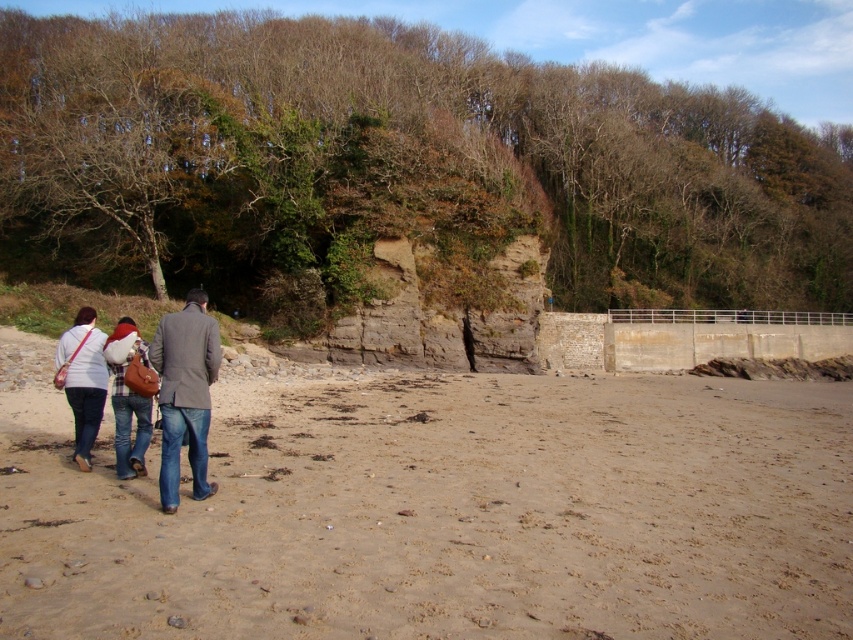
Question: Does brown leafy tree at upper center have a lesser width compared to denim jacket at lower left?

Choices:
 (A) no
 (B) yes

Answer: (A)

Question: Does sandy at left appear over matte white shirt at lower left?

Choices:
 (A) no
 (B) yes

Answer: (A)

Question: Which of these objects is positioned farthest from the matte white shirt at lower left?

Choices:
 (A) denim jacket at left
 (B) brown leafy tree at upper center
 (C) denim jacket at lower left

Answer: (B)

Question: Which point is farther from the camera taking this photo?

Choices:
 (A) (213, 317)
 (B) (270, 401)
 (C) (74, 424)

Answer: (B)

Question: Which point is closer to the camera?

Choices:
 (A) pos(164,509)
 (B) pos(453,442)

Answer: (A)

Question: From the image, what is the correct spatial relationship of brown leafy tree at upper center in relation to matte white shirt at lower left?

Choices:
 (A) right
 (B) left

Answer: (A)